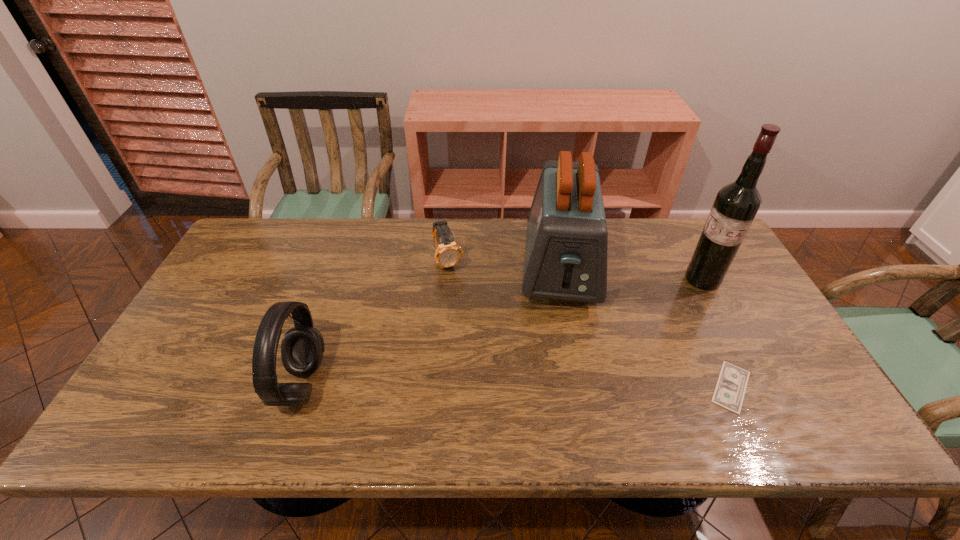
In order to click on vacant region at the near left corner of the desktop in this screenshot , I will do `click(151, 403)`.

You are a GUI agent. You are given a task and a screenshot of the screen. Output one action in this format:
    pyautogui.click(x=<x>, y=<y>)
    Task: Click on the vacant area at the near right corner of the desktop
    
    Given the screenshot: What is the action you would take?
    pyautogui.click(x=753, y=401)

The image size is (960, 540). Find the location of `vacant region between the headset and the wine bottle`. vacant region between the headset and the wine bottle is located at coordinates (502, 332).

The image size is (960, 540). In order to click on vacant space in between the watch and the money in this screenshot , I will do `click(589, 325)`.

The height and width of the screenshot is (540, 960). What are the coordinates of `free space that is in between the second shortest object and the third object from left to right` in the screenshot? It's located at (504, 265).

Identify the location of unoccupied position between the third tallest object and the third object from right to left. This screenshot has width=960, height=540. (431, 327).

You are a GUI agent. You are given a task and a screenshot of the screen. Output one action in this format:
    pyautogui.click(x=<x>, y=<y>)
    Task: Click on the vacant space that is in between the shortest object and the wine bottle
    
    Given the screenshot: What is the action you would take?
    pyautogui.click(x=717, y=333)

What are the coordinates of `vacant area that lies between the toaster and the tallest object` in the screenshot? It's located at (632, 274).

The image size is (960, 540). Identify the location of free space between the toaster and the tallest object. (632, 274).

Locate an element on the screen. The height and width of the screenshot is (540, 960). free space between the money and the tallest object is located at coordinates (717, 333).